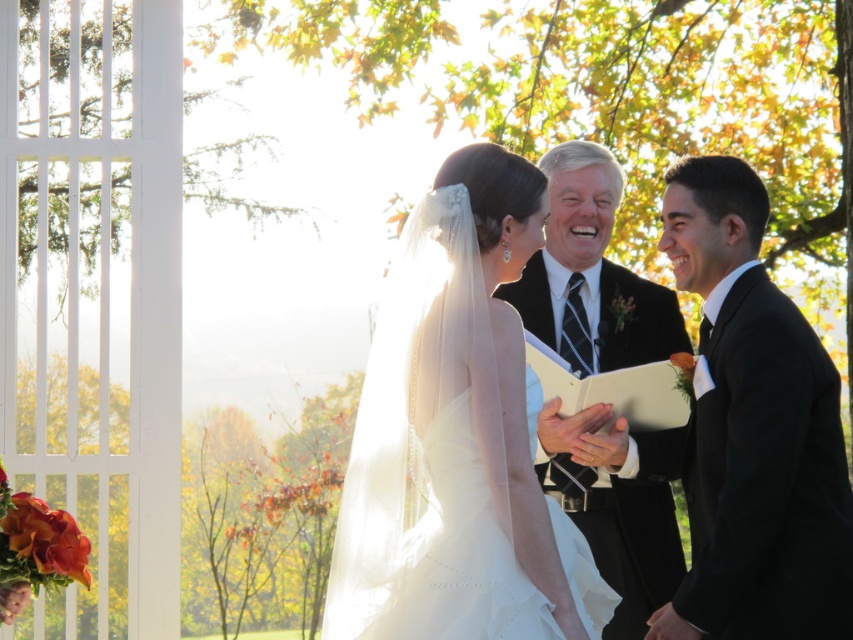
You are a photographer at a wedding and need to capture a photo of the white satin dress at center and the black satin suit at right. From your current position, which one is closer to you?

The white satin dress at center is closer to you because it is in front of the black satin suit at right.

You are a photographer at the wedding and need to capture a photo of both the black satin suit at right and the black satin suit at center. Which one is located to the right of the other?

The black satin suit at right is positioned on the right side of the black satin suit at center.